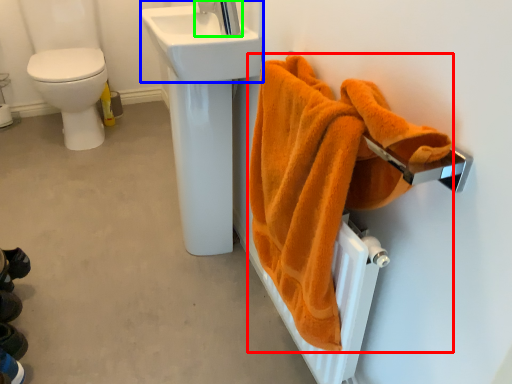
Question: Considering the real-world distances, which object is farthest from towel (highlighted by a red box)? sink (highlighted by a blue box) or tap (highlighted by a green box)?

Choices:
 (A) sink
 (B) tap

Answer: (B)